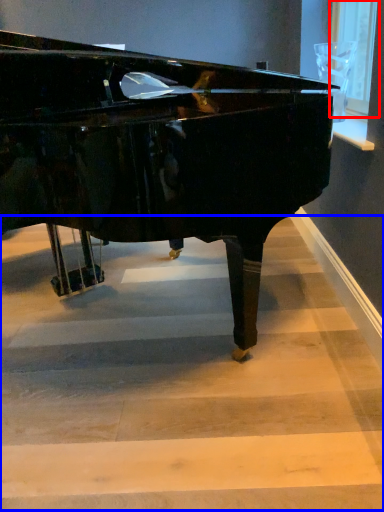
Question: Among these objects, which one is nearest to the camera, window screen (highlighted by a red box) or stairwell (highlighted by a blue box)?

Choices:
 (A) window screen
 (B) stairwell

Answer: (B)